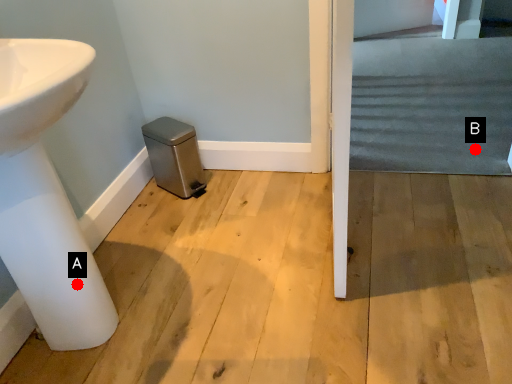
Question: Two points are circled on the image, labeled by A and B beside each circle. Which point is farther from the camera taking this photo?

Choices:
 (A) A is further
 (B) B is further

Answer: (B)